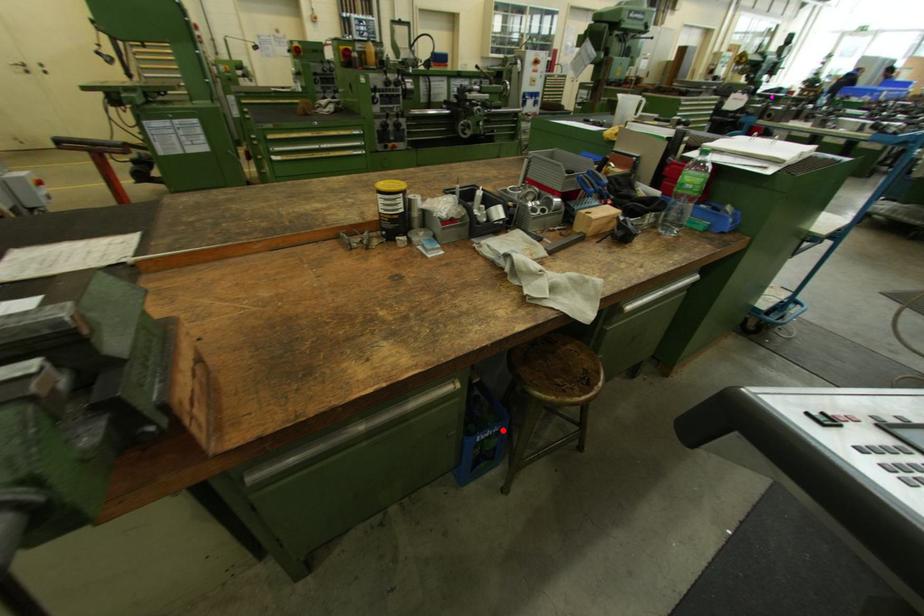
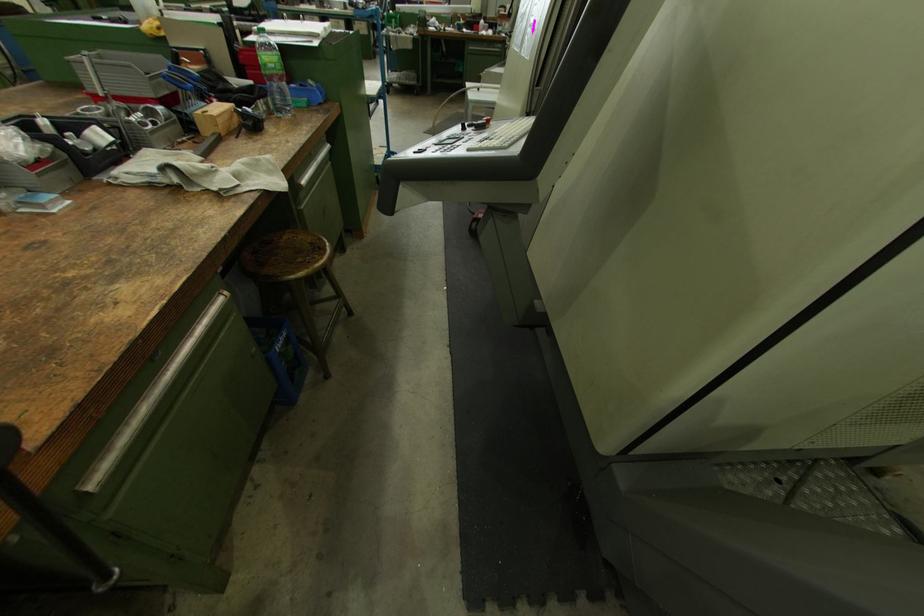
Find the pixel in the second image that matches the highlighted location in the first image.

(290, 334)